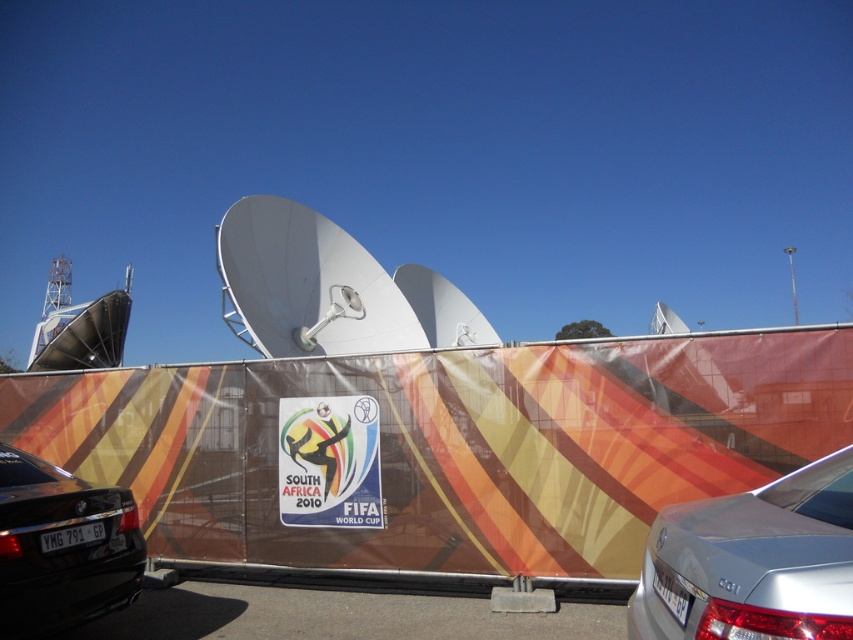
Question: Which object is closer to the camera taking this photo?

Choices:
 (A) shiny black sedan at lower left
 (B) black plastic license plate at lower left
 (C) white plastic license plate at lower right
 (D) silver metallic sedan at lower right

Answer: (D)

Question: Can you confirm if white plastic license plate at lower right is positioned to the right of black plastic license plate at lower left?

Choices:
 (A) yes
 (B) no

Answer: (A)

Question: Which object is closer to the camera taking this photo?

Choices:
 (A) shiny black sedan at lower left
 (B) white plastic license plate at lower right

Answer: (B)

Question: Which object is positioned farthest from the shiny black sedan at lower left?

Choices:
 (A) white plastic license plate at lower right
 (B) black plastic license plate at lower left

Answer: (A)

Question: Can you confirm if silver metallic sedan at lower right is bigger than white plastic license plate at lower right?

Choices:
 (A) yes
 (B) no

Answer: (A)

Question: Can you confirm if shiny black sedan at lower left is positioned to the right of white plastic license plate at lower right?

Choices:
 (A) no
 (B) yes

Answer: (A)